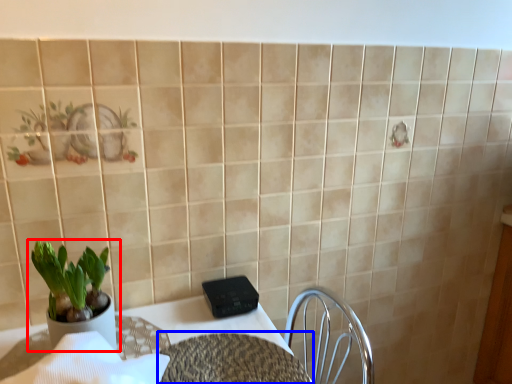
Question: Among these objects, which one is farthest to the camera, houseplant (highlighted by a red box) or round table (highlighted by a blue box)?

Choices:
 (A) houseplant
 (B) round table

Answer: (A)